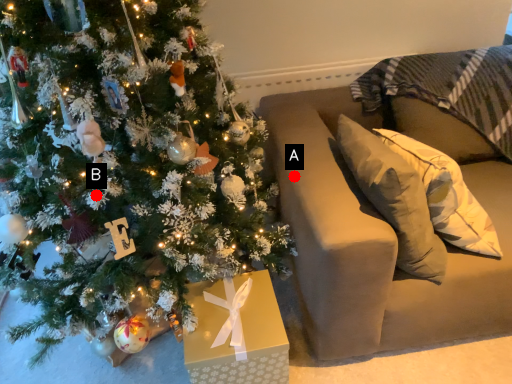
Question: Two points are circled on the image, labeled by A and B beside each circle. Which point is closer to the camera?

Choices:
 (A) A is closer
 (B) B is closer

Answer: (B)